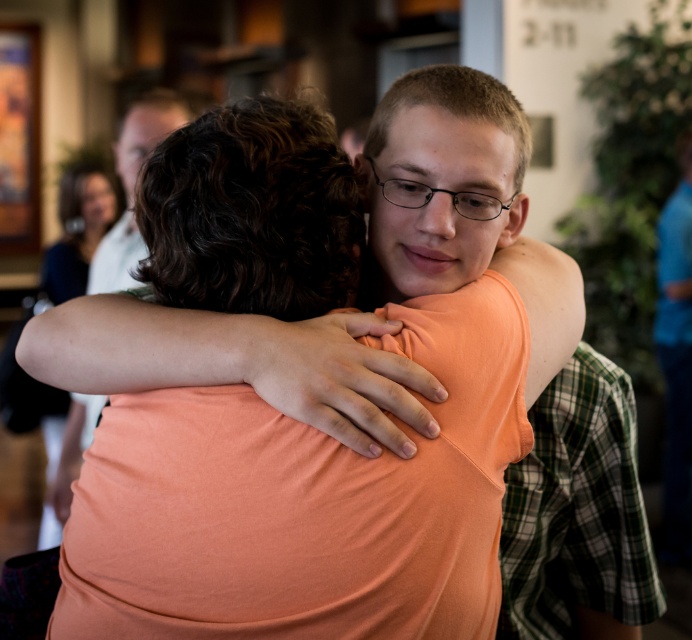
Question: Which object appears farthest from the camera in this image?

Choices:
 (A) orange smooth arm at center
 (B) orange fabric shirt at center

Answer: (B)

Question: Among these objects, which one is nearest to the camera?

Choices:
 (A) orange fabric shirt at center
 (B) orange smooth arm at center

Answer: (B)

Question: Among these objects, which one is farthest from the camera?

Choices:
 (A) orange smooth arm at center
 (B) orange fabric shirt at center

Answer: (B)

Question: Does orange smooth arm at center appear under orange fabric shirt at center?

Choices:
 (A) yes
 (B) no

Answer: (A)

Question: From the image, what is the correct spatial relationship of orange smooth arm at center in relation to orange fabric shirt at center?

Choices:
 (A) above
 (B) below

Answer: (B)

Question: Is orange smooth arm at center above orange fabric shirt at center?

Choices:
 (A) yes
 (B) no

Answer: (B)